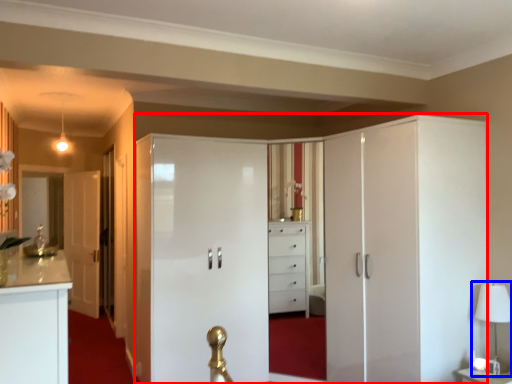
Question: Which of the following is the closest to the observer, dresser (highlighted by a red box) or table lamp (highlighted by a blue box)?

Choices:
 (A) dresser
 (B) table lamp

Answer: (A)